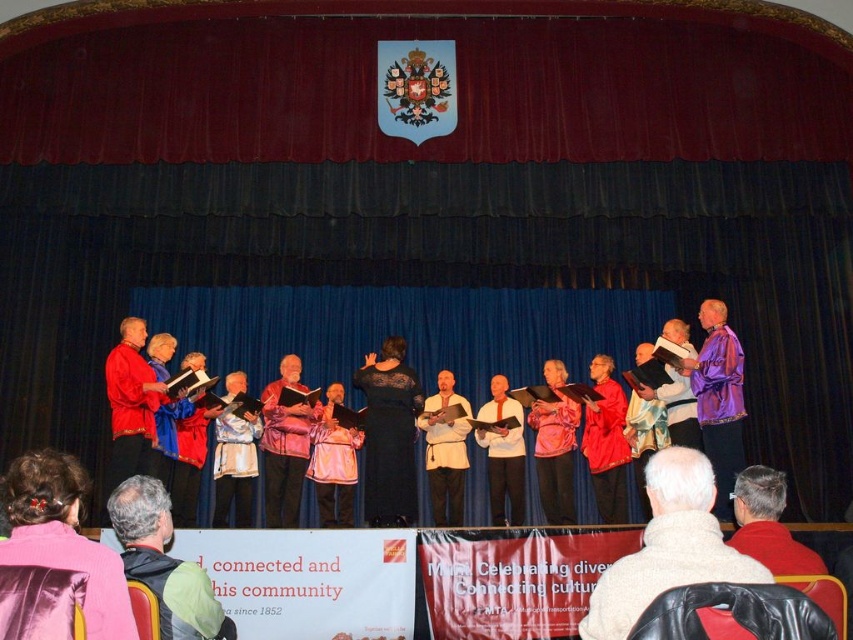
You are standing at the center of the stage and want to hand a microphone to the performer wearing the satin pink jacket at lower left. In which direction should you move to reach them?

The satin pink jacket at lower left is located at point 0.841 on the x axis and 0.076 on the y axis. Since you are at the center of the stage, you should move towards the lower left direction to reach the performer wearing the satin pink jacket at lower left.

You are a photographer standing at the back of the stage. You notice a point marked at coordinates (64, 538) on your camera screen. What object is located at that point?

The point at coordinates (64, 538) marks the location of the satin pink jacket at lower left.

You are a photographer positioned at the back of the audience. You want to take a photo of both the black lace dress at center and the leather jacket at lower right. Which one will appear larger in your photo?

The black lace dress at center will appear larger in the photo because it is closer to the photographer than the leather jacket at lower right.